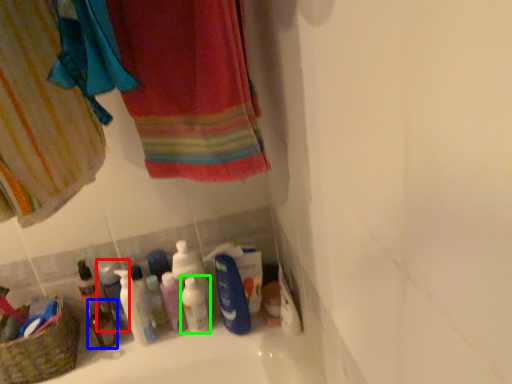
Question: Based on their relative distances, which object is nearer to mouthwash (highlighted by a red box)? Choose from mouthwash (highlighted by a blue box) and mouthwash (highlighted by a green box).

Choices:
 (A) mouthwash
 (B) mouthwash

Answer: (A)